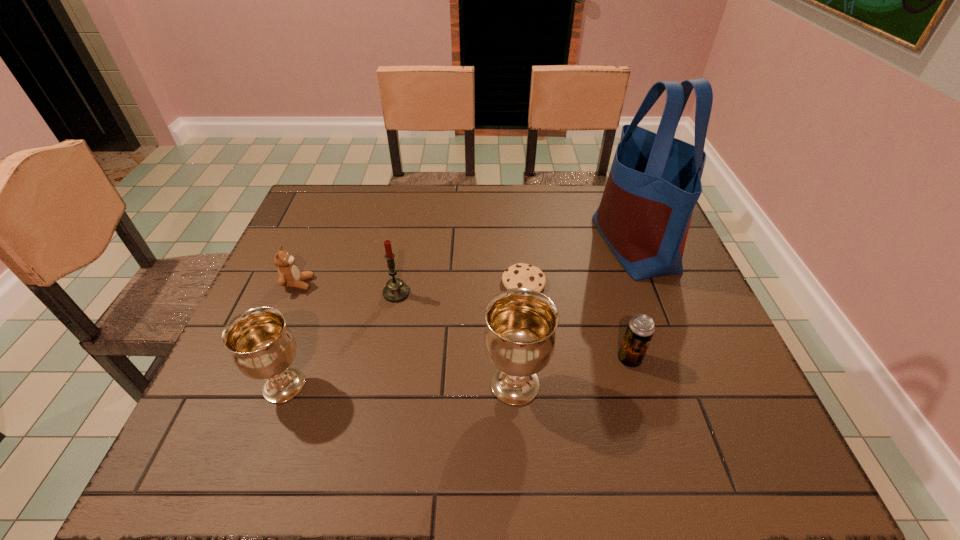
Identify the location of the shorter chalice. (262, 347).

Image resolution: width=960 pixels, height=540 pixels. What are the coordinates of `the right chalice` in the screenshot? It's located at (519, 338).

Locate an element on the screen. This screenshot has width=960, height=540. the taller chalice is located at coordinates (519, 338).

I want to click on candle, so click(395, 290).

The width and height of the screenshot is (960, 540). Identify the location of teddy bear. (288, 273).

Find the location of a particular element. This screenshot has height=540, width=960. handbag is located at coordinates (654, 183).

Where is `cookie`? This screenshot has width=960, height=540. cookie is located at coordinates (520, 275).

This screenshot has height=540, width=960. I want to click on beer can, so click(x=640, y=329).

The image size is (960, 540). What are the coordinates of `free space located 0.110m on the right of the shorter chalice` in the screenshot? It's located at (362, 386).

Where is `free space located on the left of the second tallest object`? free space located on the left of the second tallest object is located at coordinates (413, 384).